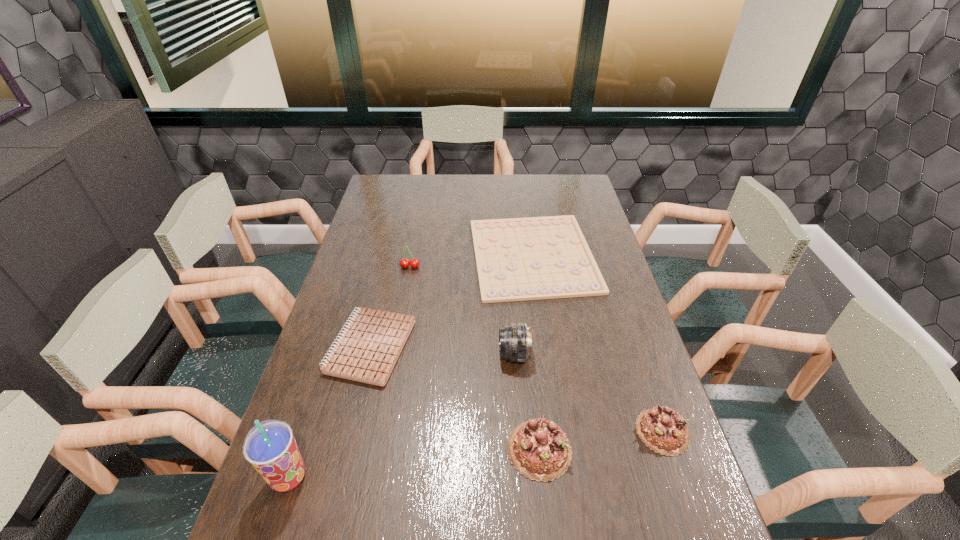
Please point a vacant point for placing a chocolate cake on the left. Please provide its 2D coordinates. Your answer should be formatted as a tuple, i.e. [(x, y)], where the tuple contains the x and y coordinates of a point satisfying the conditions above.

[(408, 469)]